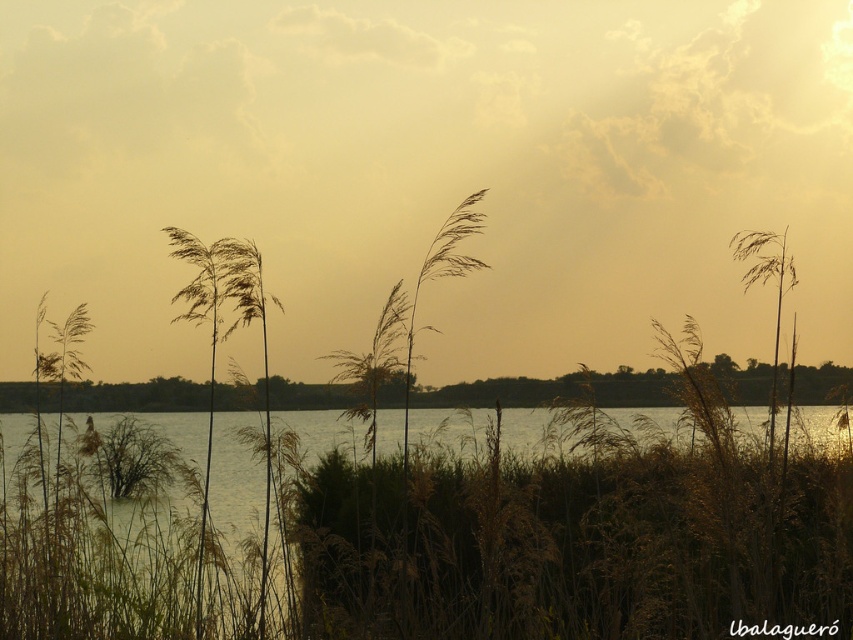
You are an artist trying to paint the scene. You want to ensure the sandy yellow cloud at upper center and brown dry grass at center are placed correctly. Which object should be drawn first to maintain the spatial relationship shown in the image?

The brown dry grass at center should be drawn first because the sandy yellow cloud at upper center is positioned over it, meaning the cloud is in front and the grass is behind. To layer them correctly, start with the background element, the brown dry grass at center, then add the cloud on top.

Based on the coordinates provided, can you identify which object in the scene corresponds to the point labeled as point (427, 170)?

The point (427, 170) corresponds to the sandy yellow cloud at upper center.